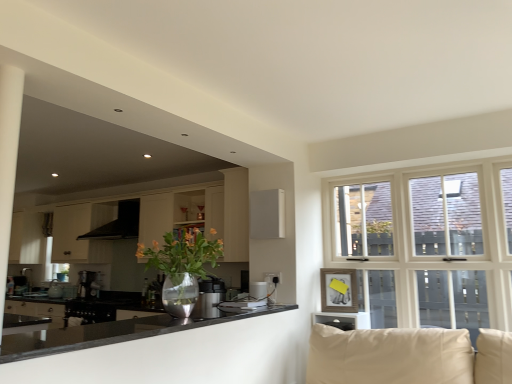
Locate an element on the screen. This screenshot has height=384, width=512. satin silver coffee machine at left is located at coordinates (89, 284).

Locate an element on the screen. black glossy countertop at lower left is located at coordinates (109, 334).

The image size is (512, 384). I want to click on matte wood cabinet at center, marked as the first cabinetry in a front-to-back arrangement, so click(x=236, y=215).

Describe the element at coordinates (210, 297) in the screenshot. This screenshot has height=384, width=512. I see `satin silver kettle at center` at that location.

Identify the location of satin silver coffee machine at left. The image size is (512, 384). (89, 284).

Considering the positions of point (122, 203) and point (206, 244), is point (122, 203) closer or farther from the camera than point (206, 244)?

Point (122, 203) is farther from the camera than point (206, 244).

From a real-world perspective, which object rests below the other?

metallic vase with flowers at center.

Can metallic vase with flowers at center be found inside black matte exhaust hood at upper left?

No, black matte exhaust hood at upper left does not contain metallic vase with flowers at center.

Considering the positions of points (205, 302) and (125, 215), is point (205, 302) closer to camera compared to point (125, 215)?

Yes, it is.

Which object is positioned more to the right, satin silver kettle at center or black matte exhaust hood at upper left?

Positioned to the right is satin silver kettle at center.

Who is more distant, satin silver kettle at center or black matte exhaust hood at upper left?

Positioned behind is black matte exhaust hood at upper left.

From the image's perspective, is satin silver coffee machine at left above white matte cabinet at left, the second cabinetry in the right-to-left sequence?

Incorrect, from the image's perspective, satin silver coffee machine at left is lower than white matte cabinet at left, the second cabinetry in the right-to-left sequence.

In the scene shown: Is the position of satin silver coffee machine at left more distant than that of white matte cabinet at left, the second cabinetry in the right-to-left sequence?

That is True.

Considering the relative sizes of satin silver coffee machine at left and white matte cabinet at left, the first cabinetry when ordered from left to right, in the image provided, is satin silver coffee machine at left shorter than white matte cabinet at left, the first cabinetry when ordered from left to right,?

Yes, satin silver coffee machine at left is shorter than white matte cabinet at left, the first cabinetry when ordered from left to right.

Considering the relative positions of matte wood cabinet at center, marked as the first cabinetry in a front-to-back arrangement, and black matte exhaust hood at upper left in the image provided, is matte wood cabinet at center, marked as the first cabinetry in a front-to-back arrangement, behind black matte exhaust hood at upper left?

No, it is not.

Is matte wood cabinet at center, which is the second cabinetry from back to front, bigger than black matte exhaust hood at upper left?

Actually, matte wood cabinet at center, which is the second cabinetry from back to front, might be smaller than black matte exhaust hood at upper left.

Can you confirm if matte wood cabinet at center, which ranks as the 1th cabinetry in right-to-left order, is thinner than black matte exhaust hood at upper left?

Yes, matte wood cabinet at center, which ranks as the 1th cabinetry in right-to-left order, is thinner than black matte exhaust hood at upper left.

Between point (247, 214) and point (122, 226), which one is positioned behind?

Point (122, 226)

Measure the distance from white matte cabinet at left, the second cabinetry in the right-to-left sequence, to black matte exhaust hood at upper left.

They are 9.31 inches apart.

What are the coordinates of `exhaust hood above the white matte cabinet at left, which ranks as the first cabinetry in back-to-front order (from a real-world perspective)` in the screenshot? It's located at (119, 223).

Considering the points (59, 261) and (134, 211), which point is behind, point (59, 261) or point (134, 211)?

The point (59, 261) is behind.

Looking at this image, which object is wider, black glossy countertop at lower left or metallic vase with flowers at center?

With larger width is black glossy countertop at lower left.

Is black glossy countertop at lower left with metallic vase with flowers at center?

black glossy countertop at lower left and metallic vase with flowers at center are clearly separated.

From a real-world perspective, is black glossy countertop at lower left physically above metallic vase with flowers at center?

Incorrect, from a real-world perspective, black glossy countertop at lower left is lower than metallic vase with flowers at center.

Is point (81, 333) positioned after point (223, 198)?

That is False.

From the image's perspective, which one is positioned higher, black glossy countertop at lower left or matte wood cabinet at center, positioned as the 2th cabinetry in left-to-right order?

From the image's view, matte wood cabinet at center, positioned as the 2th cabinetry in left-to-right order, is above.

Can you confirm if black glossy countertop at lower left is positioned to the left of matte wood cabinet at center, which ranks as the 1th cabinetry in right-to-left order?

Correct, you'll find black glossy countertop at lower left to the left of matte wood cabinet at center, which ranks as the 1th cabinetry in right-to-left order.

Where is `exhaust hood that is above the metallic vase with flowers at center (from a real-world perspective)`? The width and height of the screenshot is (512, 384). exhaust hood that is above the metallic vase with flowers at center (from a real-world perspective) is located at coordinates (119, 223).

Where is `appliance directly beneath the black matte exhaust hood at upper left (from a real-world perspective)`? The height and width of the screenshot is (384, 512). appliance directly beneath the black matte exhaust hood at upper left (from a real-world perspective) is located at coordinates (210, 297).

Estimate the real-world distances between objects in this image. Which object is further from metallic vase with flowers at center, satin silver kettle at center or satin silver coffee machine at left?

satin silver coffee machine at left.

Based on their spatial positions, is metallic vase with flowers at center or satin silver kettle at center further from satin silver coffee machine at left?

Based on the image, metallic vase with flowers at center appears to be further to satin silver coffee machine at left.

Estimate the real-world distances between objects in this image. Which object is further from matte wood cabinet at center, marked as the first cabinetry in a front-to-back arrangement, satin silver kettle at center or metallic vase with flowers at center?

The object further to matte wood cabinet at center, marked as the first cabinetry in a front-to-back arrangement, is satin silver kettle at center.

From the image, which object appears to be farther from black glossy countertop at lower left, white matte cabinet at left, the 2th cabinetry when ordered from front to back, or satin silver kettle at center?

white matte cabinet at left, the 2th cabinetry when ordered from front to back, lies further to black glossy countertop at lower left than the other object.

Estimate the real-world distances between objects in this image. Which object is further from metallic vase with flowers at center, white matte cabinet at left, the 2th cabinetry when ordered from front to back, or black matte exhaust hood at upper left?

Based on the image, white matte cabinet at left, the 2th cabinetry when ordered from front to back, appears to be further to metallic vase with flowers at center.

Based on their spatial positions, is satin silver coffee machine at left or matte wood cabinet at center, which is the second cabinetry from back to front, further from white matte cabinet at left, the 2th cabinetry when ordered from front to back?

Among the two, matte wood cabinet at center, which is the second cabinetry from back to front, is located further to white matte cabinet at left, the 2th cabinetry when ordered from front to back.

When comparing their distances from satin silver coffee machine at left, does metallic vase with flowers at center or black glossy countertop at lower left seem further?

The object further to satin silver coffee machine at left is metallic vase with flowers at center.

Considering their positions, is black matte exhaust hood at upper left positioned closer to white matte cabinet at left, which ranks as the first cabinetry in back-to-front order, than black glossy countertop at lower left?

black matte exhaust hood at upper left lies closer to white matte cabinet at left, which ranks as the first cabinetry in back-to-front order, than the other object.

Identify the location of exhaust hood located between metallic vase with flowers at center and satin silver coffee machine at left in the depth direction. Image resolution: width=512 pixels, height=384 pixels. (119, 223).

The image size is (512, 384). What are the coordinates of `exhaust hood positioned between white matte cabinet at left, the 2th cabinetry when ordered from front to back, and satin silver coffee machine at left from near to far` in the screenshot? It's located at (119, 223).

Identify the location of houseplant between black glossy countertop at lower left and satin silver coffee machine at left from front to back. (181, 267).

Find the location of `exhaust hood situated between white matte cabinet at left, the first cabinetry when ordered from left to right, and matte wood cabinet at center, positioned as the 2th cabinetry in left-to-right order, from left to right`. exhaust hood situated between white matte cabinet at left, the first cabinetry when ordered from left to right, and matte wood cabinet at center, positioned as the 2th cabinetry in left-to-right order, from left to right is located at coordinates (119, 223).